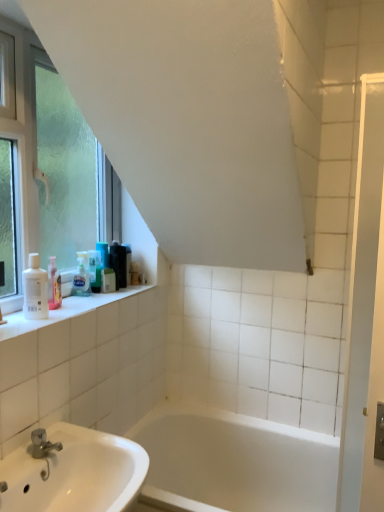
Question: In the image, is black plastic container at upper left, the 6th toiletry positioned from the front, positioned in front of or behind translucent plastic bottles at upper left, the second toiletry viewed from the back?

Choices:
 (A) behind
 (B) front

Answer: (A)

Question: Is black plastic container at upper left, the 6th toiletry positioned from the front, inside the boundaries of translucent plastic bottles at upper left, the fifth toiletry when ordered from front to back, or outside?

Choices:
 (A) outside
 (B) inside

Answer: (A)

Question: Which is nearer to the translucent plastic bottle at upper left, which is the third toiletry from back to front?

Choices:
 (A) clear plastic soap dispenser at upper left, which is the 2th toiletry in front-to-back order
 (B) translucent plastic bottle at upper left, the third toiletry from the front
 (C) white glossy screen door at right
 (D) frosted glass window at left
 (E) black plastic container at upper left, the first toiletry positioned from the back

Answer: (B)

Question: Which object is positioned closest to the frosted glass window at left?

Choices:
 (A) white glossy bathtub at center
 (B) white glossy screen door at right
 (C) translucent plastic bottles at upper left, the fifth toiletry when ordered from front to back
 (D) white matte lotion at left, acting as the sixth toiletry starting from the back
 (E) translucent plastic bottle at upper left, which is the third toiletry from back to front

Answer: (D)